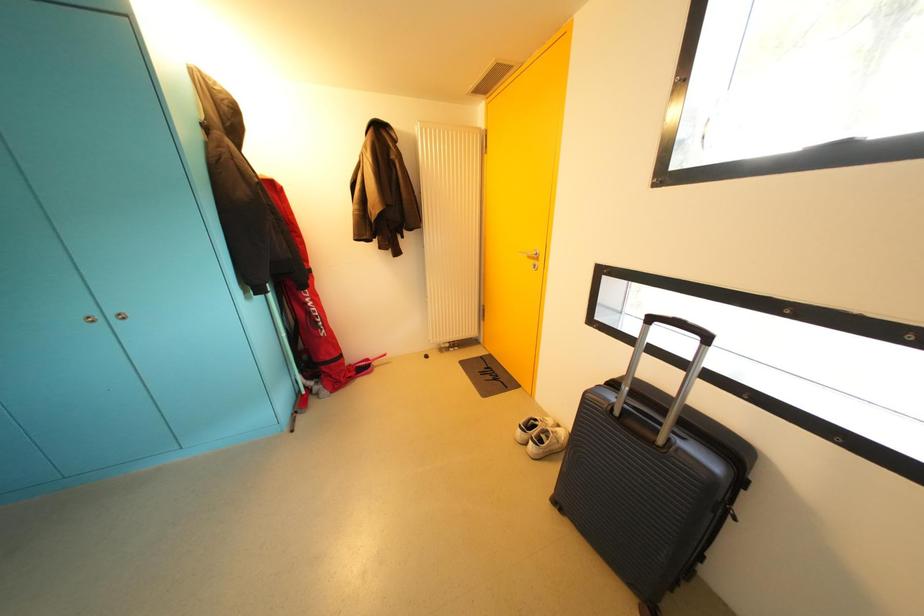
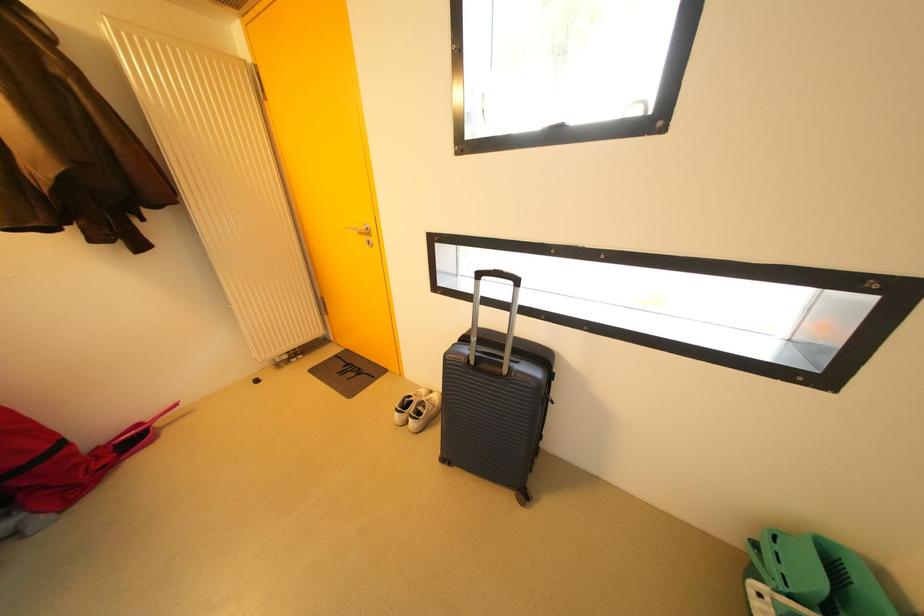
Question: The first image is from the beginning of the video and the second image is from the end. How did the camera likely rotate when shooting the video?

Choices:
 (A) Left
 (B) Right
 (C) Up
 (D) Down

Answer: (B)